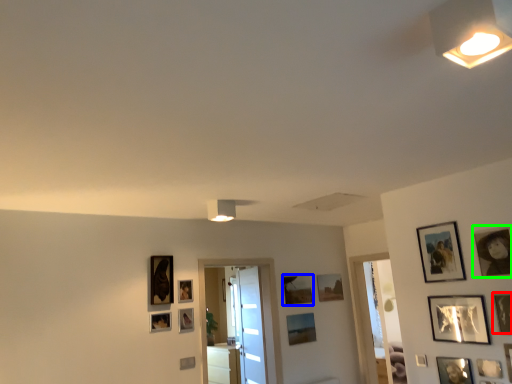
Question: Which object is positioned farthest from picture frame (highlighted by a red box)? Select from picture frame (highlighted by a blue box) and picture frame (highlighted by a green box).

Choices:
 (A) picture frame
 (B) picture frame

Answer: (A)